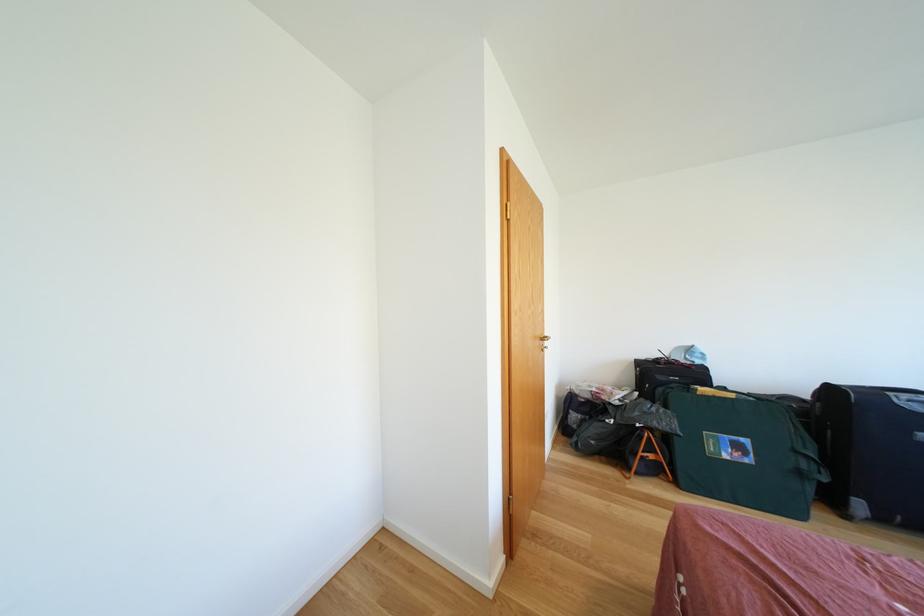
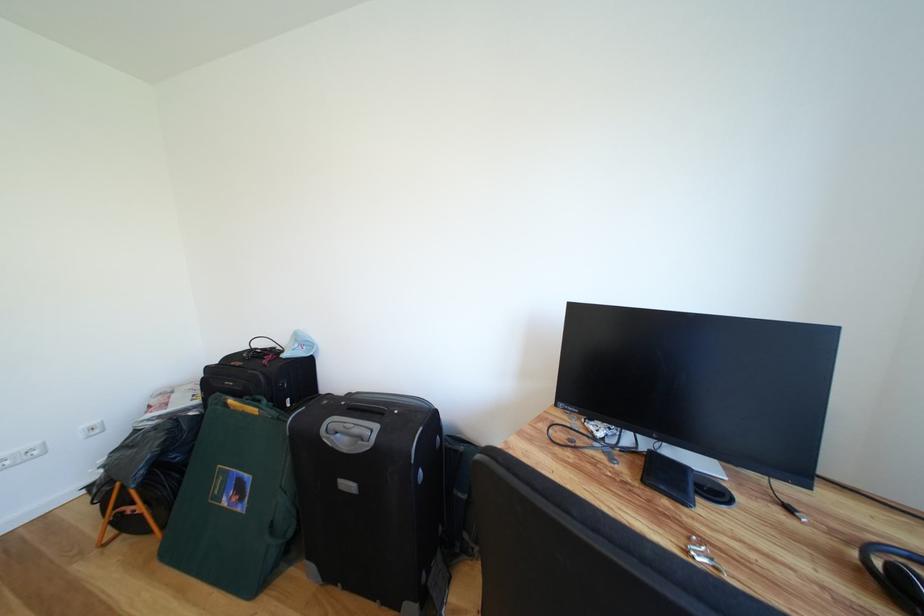
The point at (734, 461) is marked in the first image. Where is the corresponding point in the second image?

(234, 506)